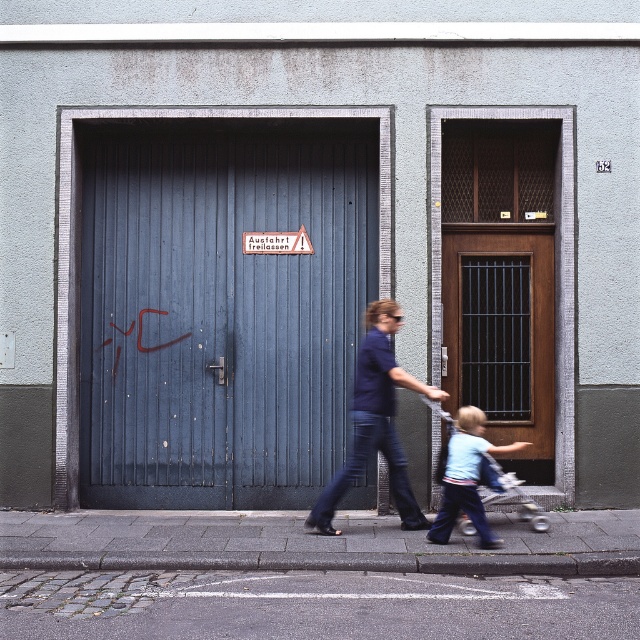
How much distance is there between cobblestone pavement at lower left and dark blue jeans at center?

The distance of cobblestone pavement at lower left from dark blue jeans at center is 4.53 feet.

Is cobblestone pavement at lower left shorter than dark blue jeans at center?

Yes, cobblestone pavement at lower left is shorter than dark blue jeans at center.

Where is `cobblestone pavement at lower left`? cobblestone pavement at lower left is located at coordinates (310, 605).

Can you confirm if blue wooden garage door at left is smaller than wooden door with metal bars at right?

No.

Is blue wooden garage door at left below wooden door with metal bars at right?

No, blue wooden garage door at left is not below wooden door with metal bars at right.

The image size is (640, 640). Identify the location of blue wooden garage door at left. (220, 308).

Locate an element on the screen. The image size is (640, 640). blue wooden garage door at left is located at coordinates (220, 308).

Based on the photo, which is more to the right, wooden door with metal bars at right or dark blue jeans at center?

wooden door with metal bars at right is more to the right.

Who is more distant from viewer, [529,268] or [356,440]?

Positioned behind is point [529,268].

The height and width of the screenshot is (640, 640). Identify the location of wooden door with metal bars at right. (502, 337).